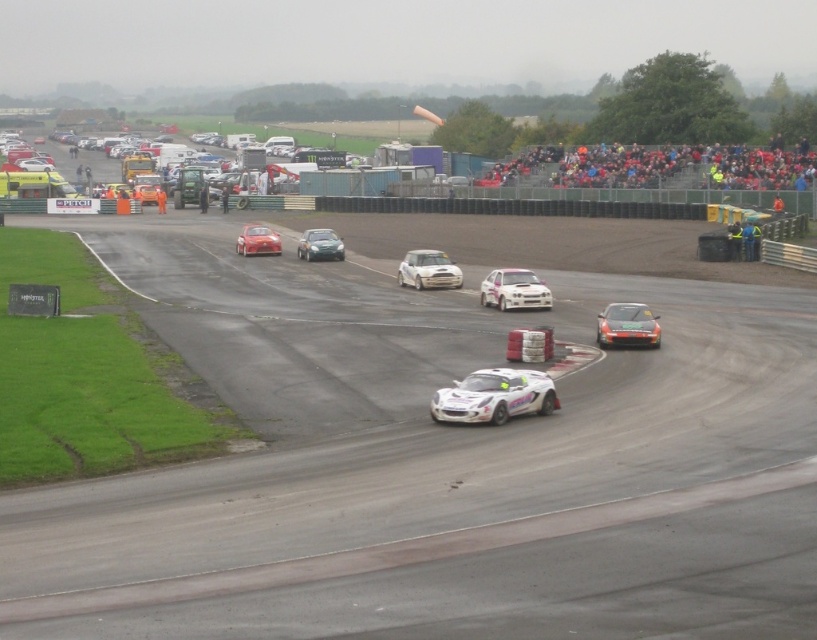
You are a race car driver observing the track. You see the white matte car at center and the shiny silver car at center. Which car is positioned to the right of the other?

The white matte car at center is to the right of the shiny silver car at center.

You are a race car driver preparing to overtake on the damp track. You notice a white matte rally car at center and a shiny red car at center ahead of you. Which car should you aim to pass first based on their widths?

The white matte rally car at center is thinner than the shiny red car at center, so you should aim to pass the white matte rally car at center first as it occupies less space on the track.